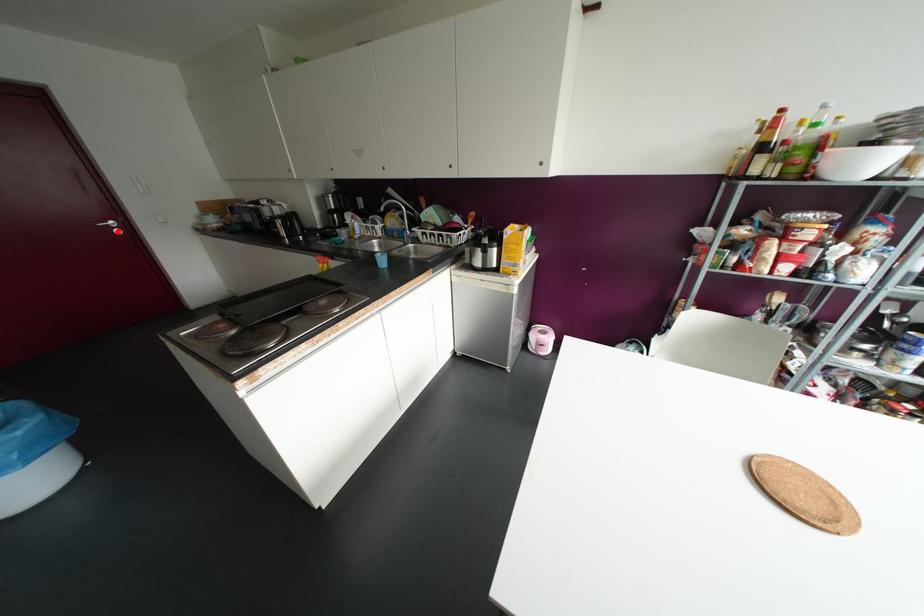
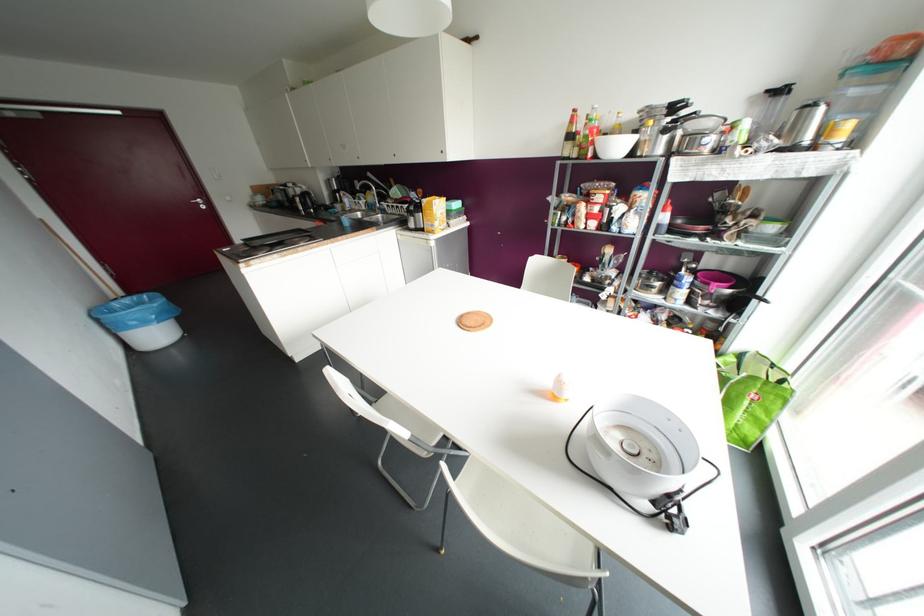
Question: I am providing you with two images of the same scene from different viewpoints. Image1 has a red point marked. In image2, the corresponding 3D location appears at what relative position? Reply with the corresponding letter.

Choices:
 (A) Closer
 (B) Farther

Answer: (A)